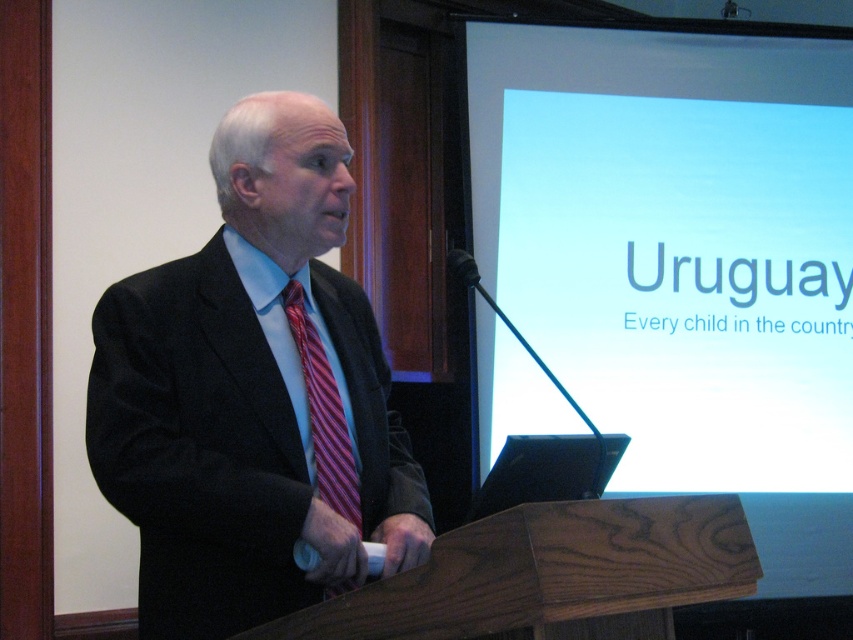
Question: Can you confirm if matte black suit at center is smaller than striped silk tie at center?

Choices:
 (A) no
 (B) yes

Answer: (A)

Question: Among these points, which one is farthest from the camera?

Choices:
 (A) (x=589, y=323)
 (B) (x=370, y=474)

Answer: (A)

Question: Which object is the closest to the white glossy screen at upper center?

Choices:
 (A) matte black suit at center
 (B) striped silk tie at center

Answer: (A)

Question: Can you confirm if white glossy screen at upper center is bigger than striped silk tie at center?

Choices:
 (A) yes
 (B) no

Answer: (A)

Question: Which point is closer to the camera taking this photo?

Choices:
 (A) (200, 458)
 (B) (496, 273)

Answer: (A)

Question: Is matte black suit at center further to the viewer compared to striped silk tie at center?

Choices:
 (A) yes
 (B) no

Answer: (B)